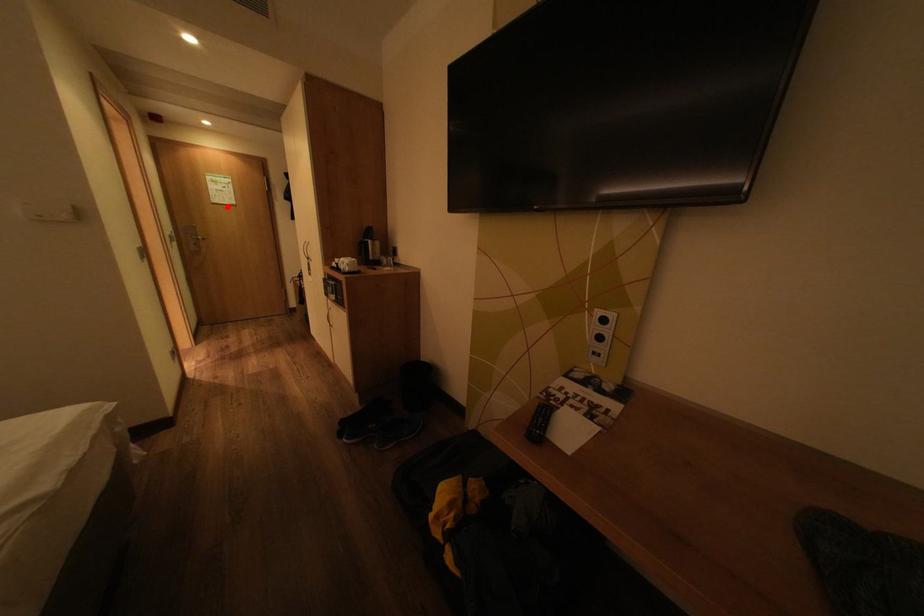
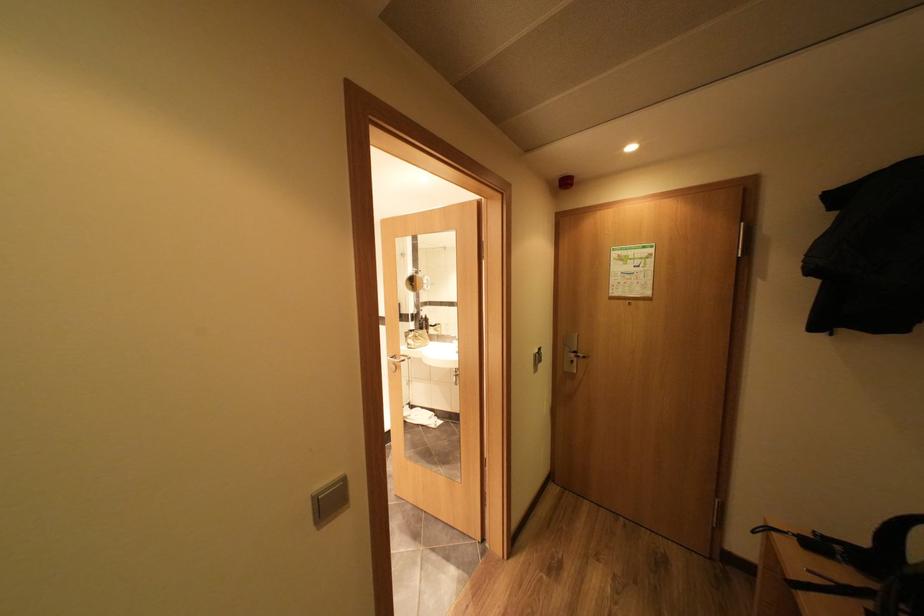
In the second image, find the point that corresponds to the highlighted location in the first image.

(626, 302)